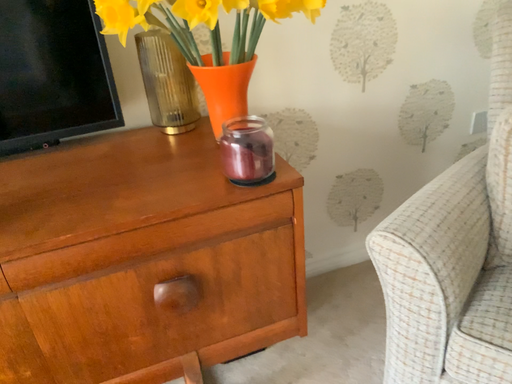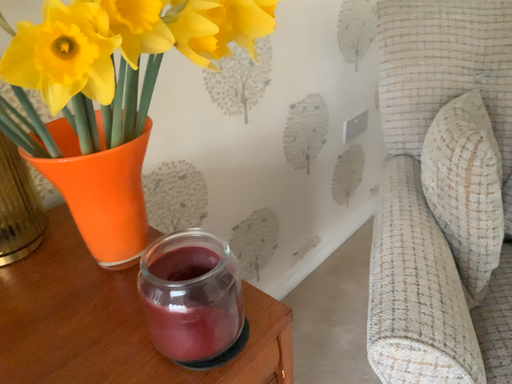
Question: How did the camera likely rotate when shooting the video?

Choices:
 (A) rotated left
 (B) rotated right

Answer: (B)